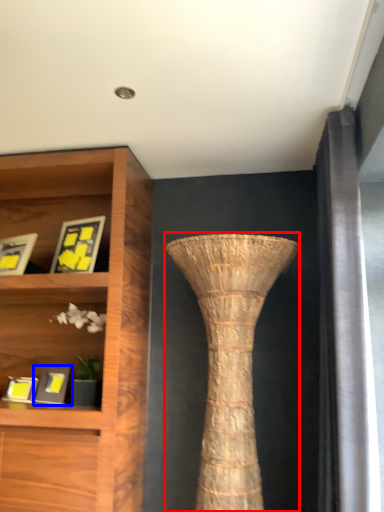
Question: Which object appears farthest to the camera in this image, vase (highlighted by a red box) or picture frame (highlighted by a blue box)?

Choices:
 (A) vase
 (B) picture frame

Answer: (B)